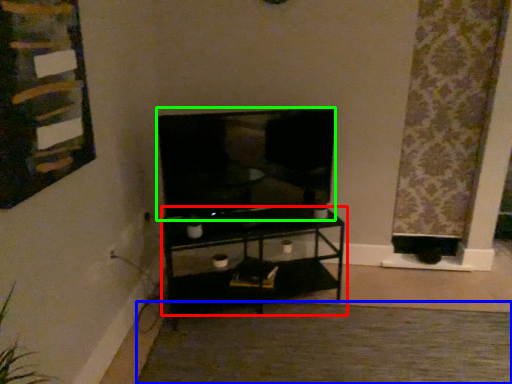
Question: Based on their relative distances, which object is farther from shelf (highlighted by a red box)? Choose from plain (highlighted by a blue box) and television (highlighted by a green box).

Choices:
 (A) plain
 (B) television

Answer: (A)